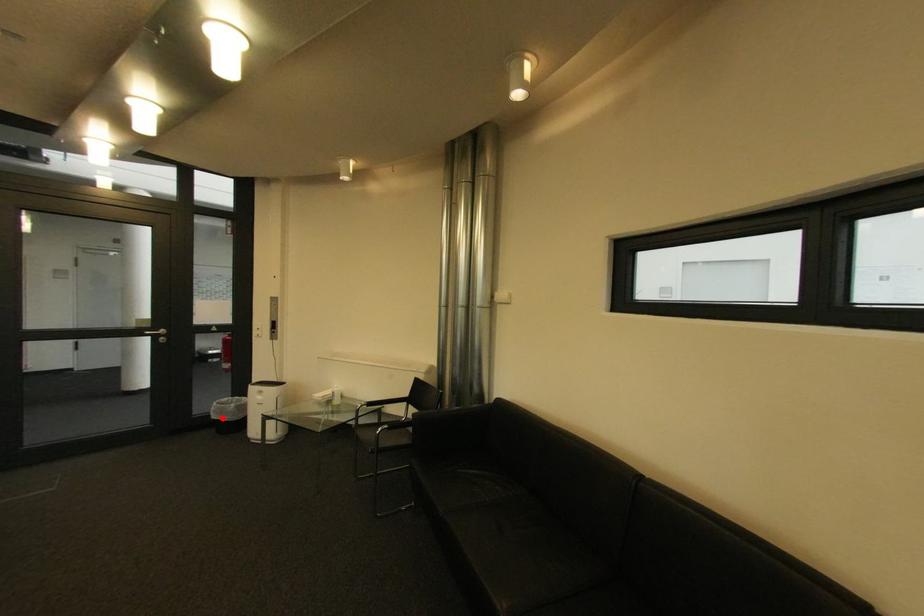
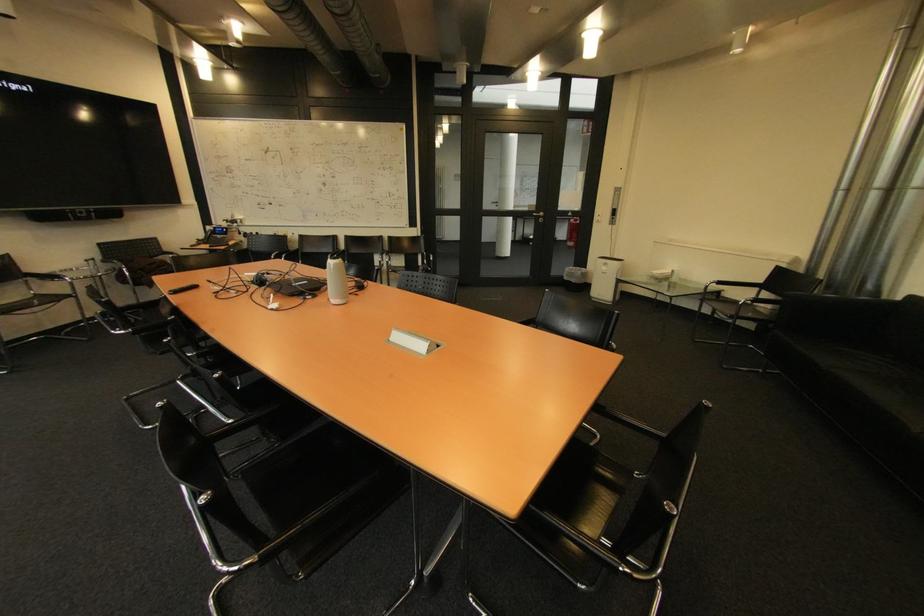
Locate, in the second image, the point that corresponds to the highlighted location in the first image.

(574, 280)